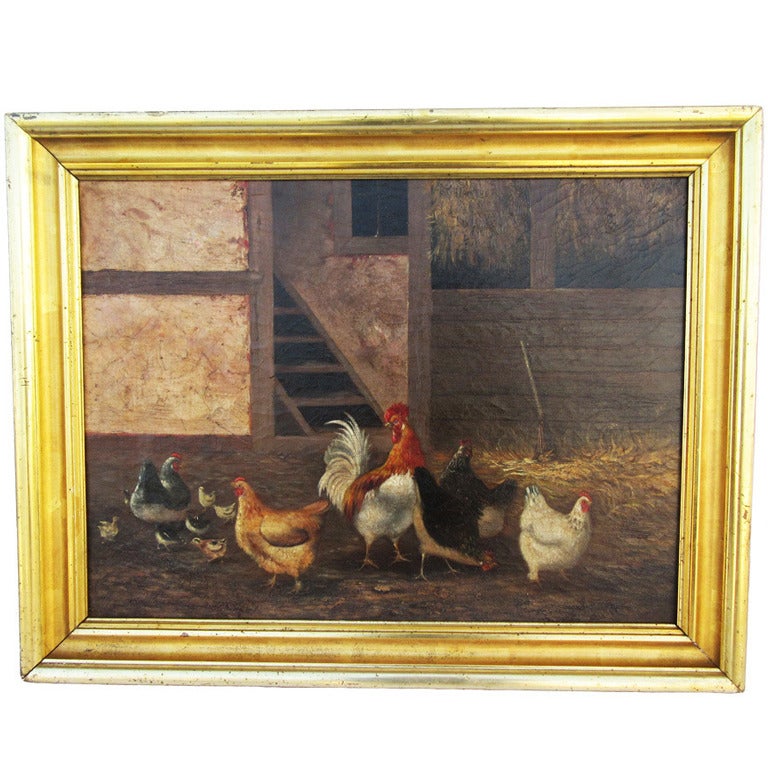
Where is `corners`? Image resolution: width=768 pixels, height=768 pixels. corners is located at coordinates (737, 121), (713, 679), (31, 664), (24, 131).